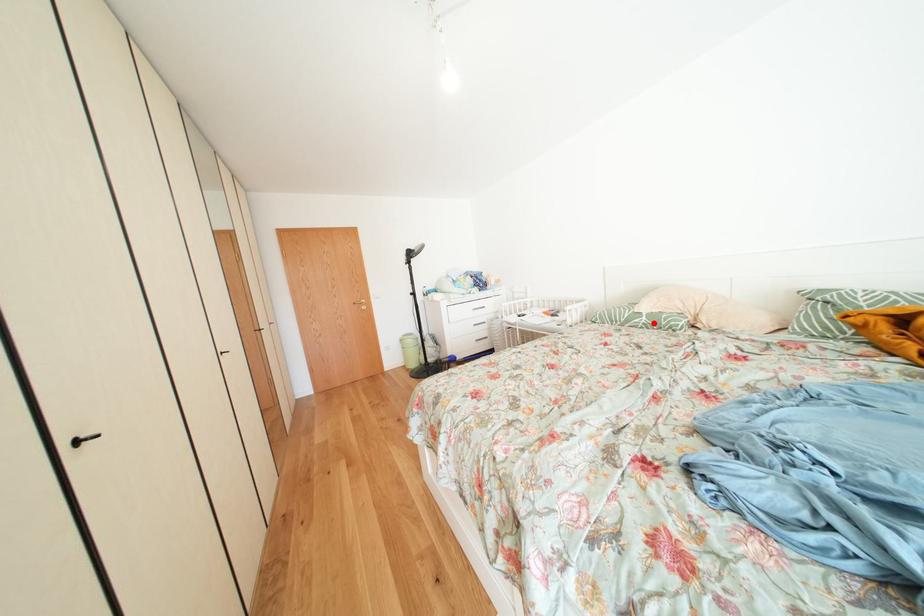
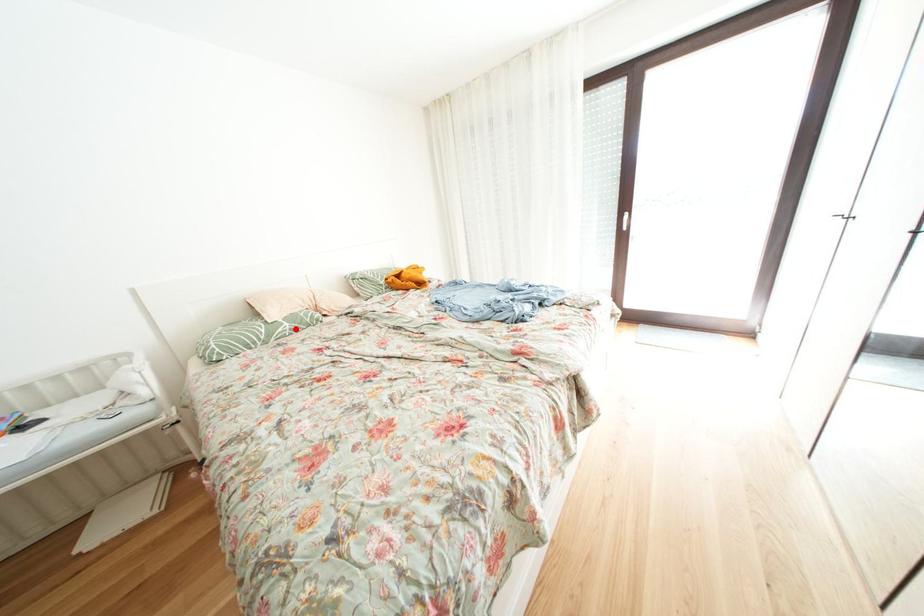
I am providing you with two images of the same scene from different viewpoints. A red point is marked on the first image and another point is marked on the second image. Is the marked point in image1 the same physical position as the marked point in image2?

Yes